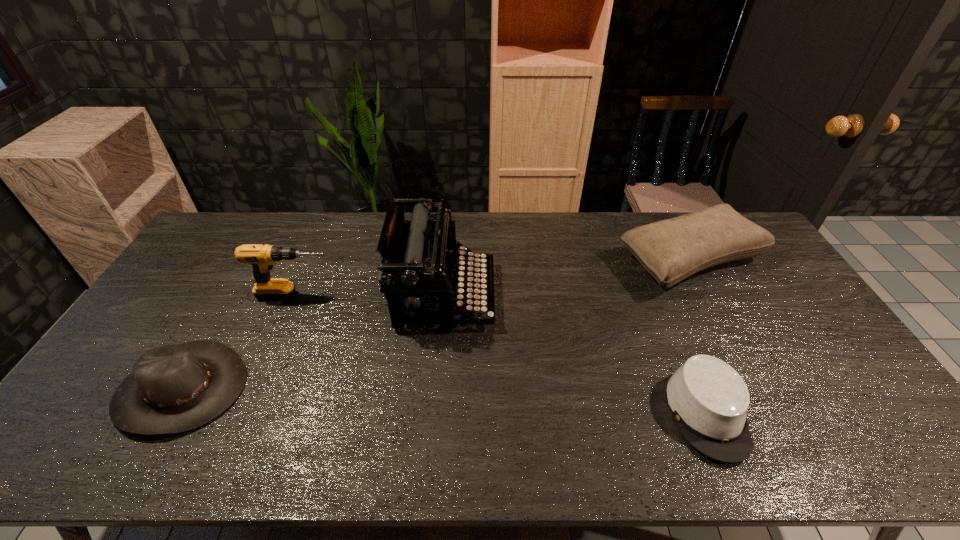
You are a GUI agent. You are given a task and a screenshot of the screen. Output one action in this format:
    pyautogui.click(x=<x>, y=<y>)
    Task: Click on the typewriter
    The image size is (960, 540).
    Given the screenshot: What is the action you would take?
    pyautogui.click(x=418, y=255)

Find the location of a particular element. the third object from right to left is located at coordinates (418, 255).

I want to click on drill, so pos(262,258).

Find the location of a particular element. the third shortest object is located at coordinates (670, 250).

At what (x,y) coordinates should I click in order to perform the action: click on the taller hat. Please return your answer as a coordinate pair (x, y). Image resolution: width=960 pixels, height=540 pixels. Looking at the image, I should click on (172, 389).

I want to click on the fourth tallest object, so click(x=172, y=389).

Find the location of a particular element. The image size is (960, 540). the shorter hat is located at coordinates (709, 399).

You are a GUI agent. You are given a task and a screenshot of the screen. Output one action in this format:
    pyautogui.click(x=<x>, y=<y>)
    Task: Click on the shortest object
    This screenshot has height=540, width=960.
    Given the screenshot: What is the action you would take?
    pyautogui.click(x=709, y=399)

At what (x,y) coordinates should I click in order to perform the action: click on vacant space positioned on the typing side of the tallest object. Please return your answer as a coordinate pair (x, y). Looking at the image, I should click on (544, 295).

At what (x,y) coordinates should I click in order to perform the action: click on free space located 0.370m at the tip of the drill. Please return your answer as a coordinate pair (x, y). This screenshot has height=540, width=960. Looking at the image, I should click on (454, 295).